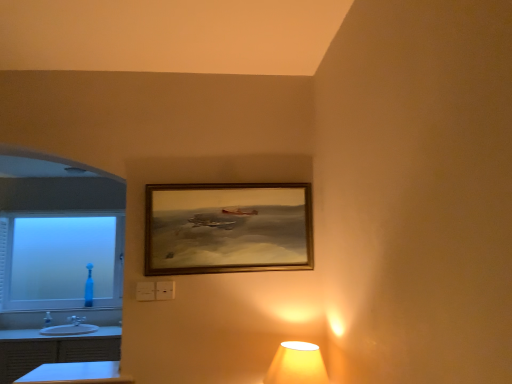
Question: Is wooden frame at center at the right side of white glossy dresser at lower left?

Choices:
 (A) yes
 (B) no

Answer: (A)

Question: From a real-world perspective, is wooden frame at center under white glossy dresser at lower left?

Choices:
 (A) no
 (B) yes

Answer: (A)

Question: Is white glossy dresser at lower left at the back of wooden frame at center?

Choices:
 (A) yes
 (B) no

Answer: (B)

Question: Can you confirm if wooden frame at center is thinner than white glossy dresser at lower left?

Choices:
 (A) yes
 (B) no

Answer: (A)

Question: Is wooden frame at center outside of white glossy dresser at lower left?

Choices:
 (A) yes
 (B) no

Answer: (A)

Question: Is white glossy dresser at lower left inside wooden frame at center?

Choices:
 (A) no
 (B) yes

Answer: (A)

Question: From a real-world perspective, is wooden frame at center physically below blue glossy table at lower left?

Choices:
 (A) no
 (B) yes

Answer: (A)

Question: Is wooden frame at center looking in the opposite direction of blue glossy table at lower left?

Choices:
 (A) yes
 (B) no

Answer: (B)

Question: Is blue glossy table at lower left surrounded by wooden frame at center?

Choices:
 (A) no
 (B) yes

Answer: (A)

Question: Is wooden frame at center placed right next to blue glossy table at lower left?

Choices:
 (A) yes
 (B) no

Answer: (B)

Question: Is wooden frame at center further to the viewer compared to blue glossy table at lower left?

Choices:
 (A) yes
 (B) no

Answer: (A)

Question: Is wooden frame at center facing towards blue glossy table at lower left?

Choices:
 (A) yes
 (B) no

Answer: (B)

Question: Is white glossy sink at lower left aimed at wooden frame at center?

Choices:
 (A) no
 (B) yes

Answer: (A)